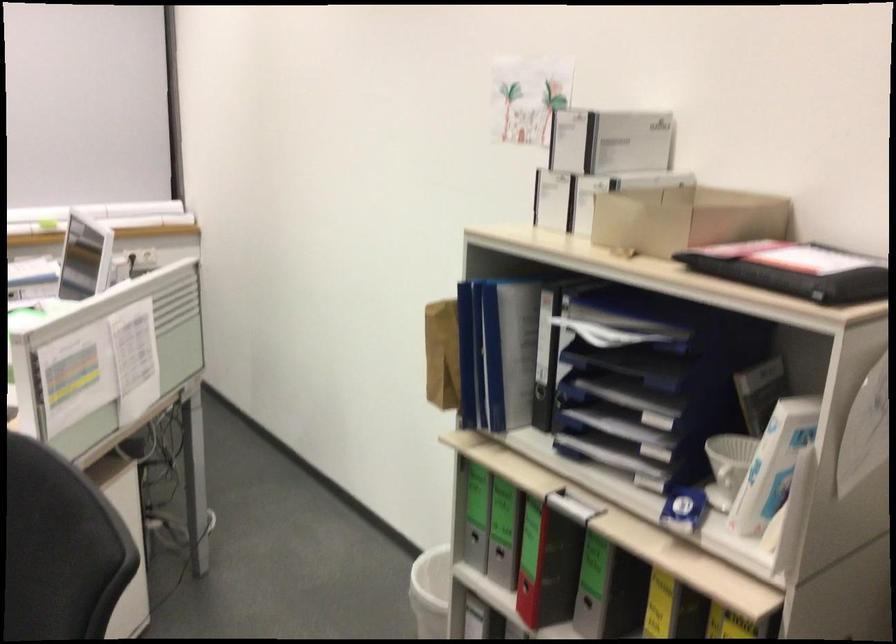
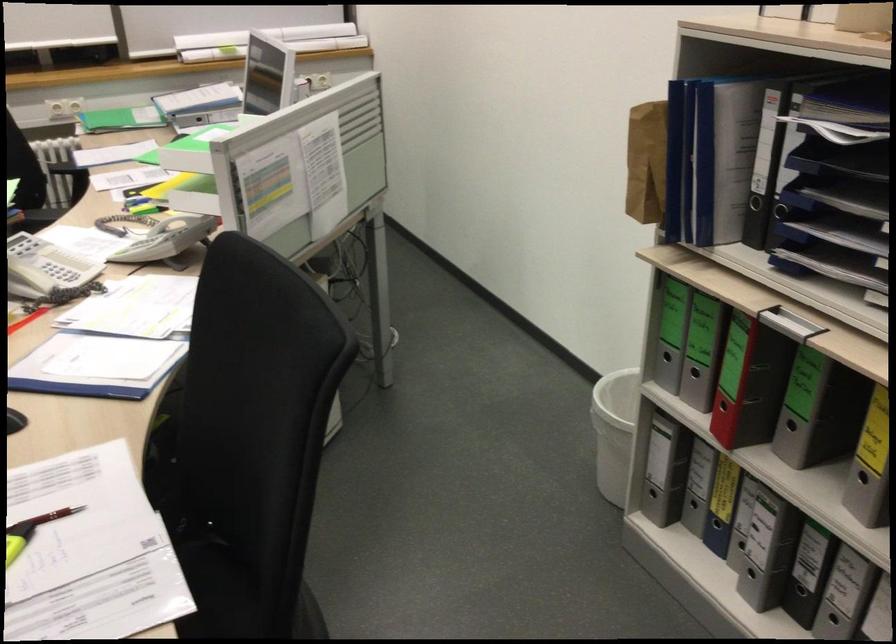
Find the pixel in the second image that matches [503,552] in the first image.

(694, 373)